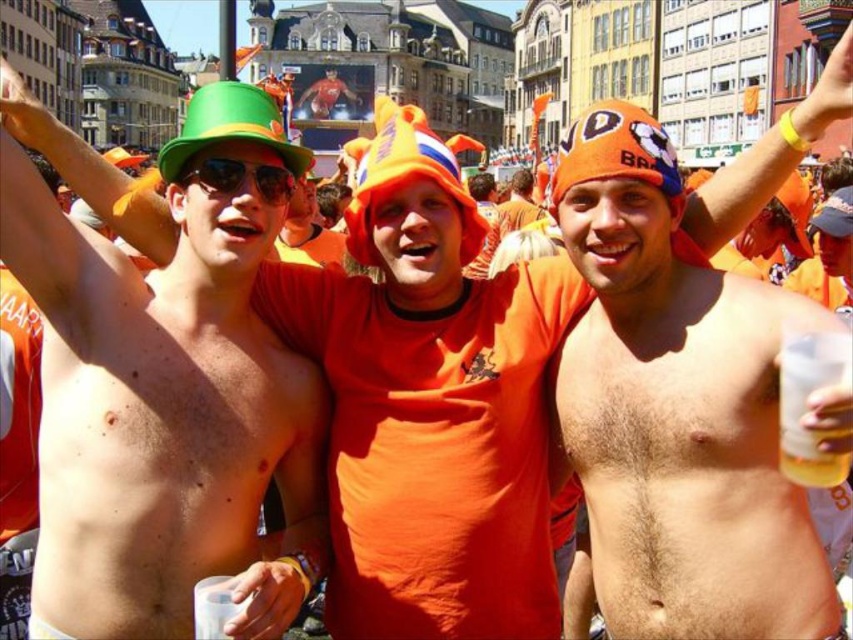
Does shiny plastic cup at upper left lie behind green matte/glossy hat at upper left?

No, it is not.

Does shiny plastic cup at upper left lie in front of green matte/glossy hat at upper left?

Yes, shiny plastic cup at upper left is closer to the viewer.

I want to click on shiny plastic cup at upper left, so click(x=167, y=397).

Identify the location of shiny plastic cup at upper left. This screenshot has height=640, width=853. (167, 397).